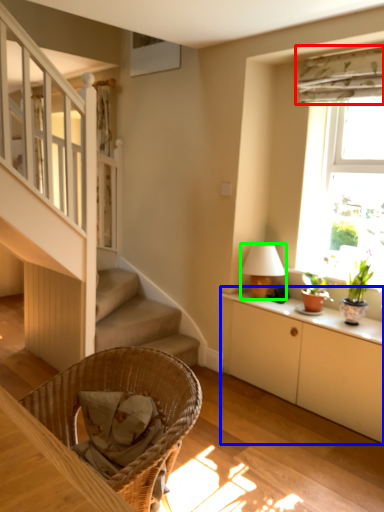
Question: Which object is the farthest from curtain (highlighted by a red box)? Choose among these: cabinetry (highlighted by a blue box) or table lamp (highlighted by a green box).

Choices:
 (A) cabinetry
 (B) table lamp

Answer: (A)